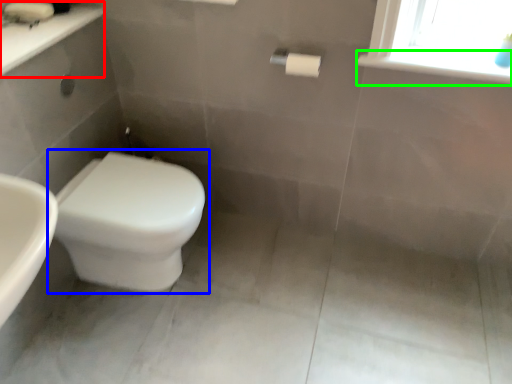
Question: Which object is the closest to the counter top (highlighted by a red box)? Choose among these: toilet (highlighted by a blue box) or window sill (highlighted by a green box).

Choices:
 (A) toilet
 (B) window sill

Answer: (A)